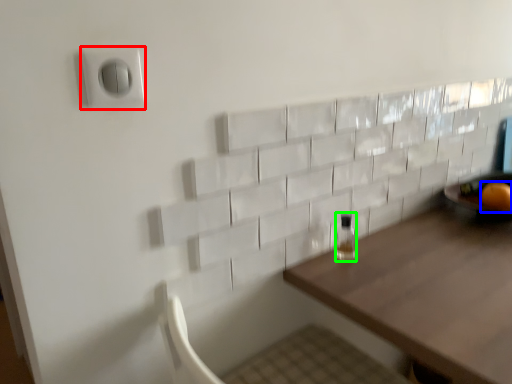
Question: Which is farther away from electric outlet (highlighted by a red box)? orange (highlighted by a blue box) or bottle (highlighted by a green box)?

Choices:
 (A) orange
 (B) bottle

Answer: (A)